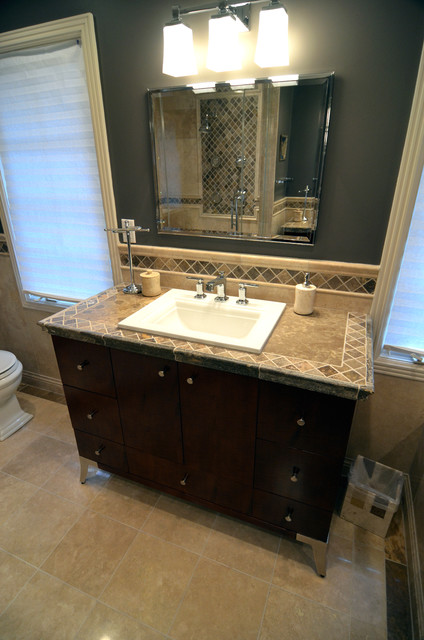
Identify the location of toilet. The height and width of the screenshot is (640, 424). (7, 374).